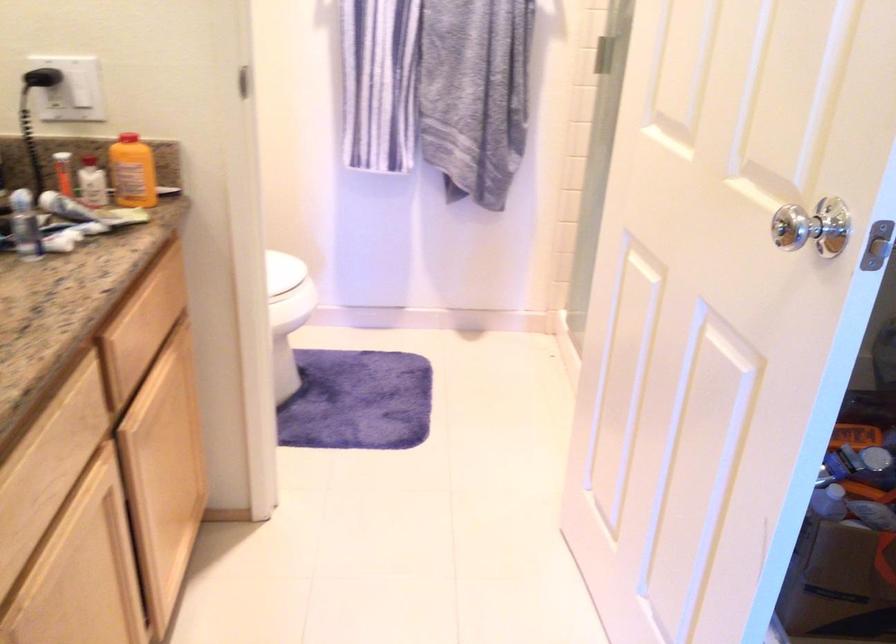
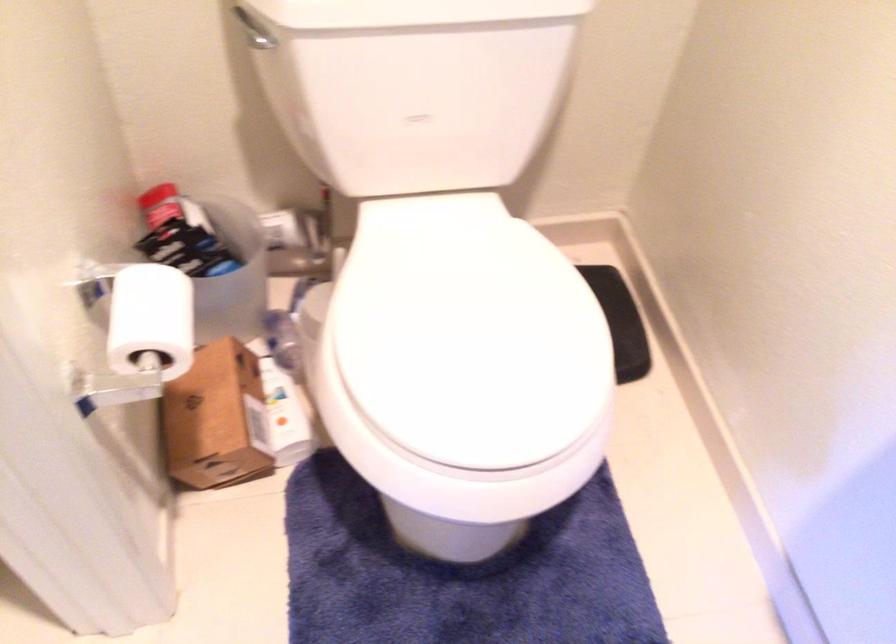
The point at (214, 275) is marked in the first image. Where is the corresponding point in the second image?

(151, 319)